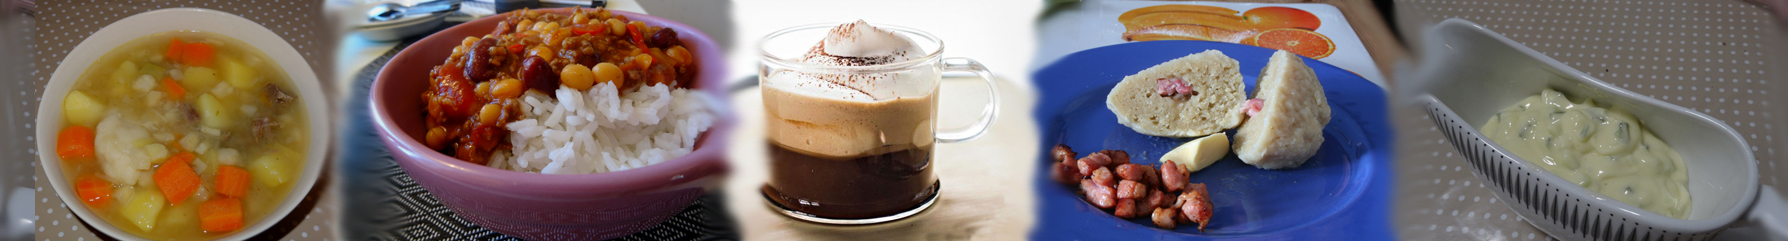
At what (x,y) coordinates should I click in order to perform the action: click on bowls to hold food. Please return your answer as a coordinate pair (x, y). The image size is (1788, 241). Looking at the image, I should click on (91, 43), (538, 189).